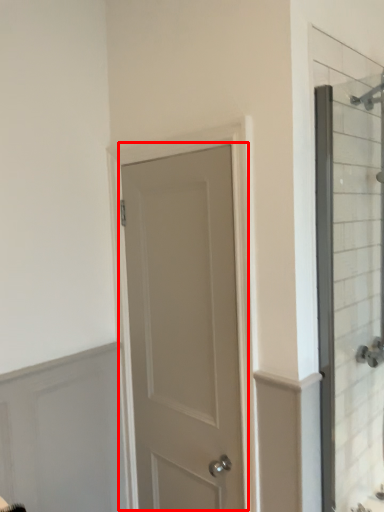
Question: From the image's perspective, what is the correct spatial positioning of door (annotated by the red box) in reference to glass door?

Choices:
 (A) below
 (B) above

Answer: (A)